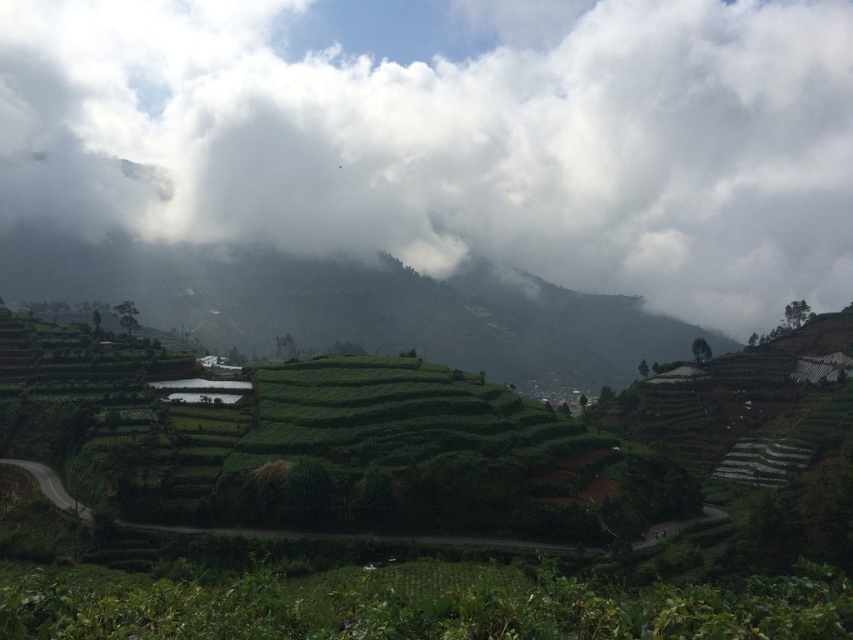
Question: Among these objects, which one is nearest to the camera?

Choices:
 (A) white fluffy cloud at upper center
 (B) green grassy hillside at center

Answer: (B)

Question: Which point appears closest to the camera in this image?

Choices:
 (A) (85, 19)
 (B) (329, 326)

Answer: (B)

Question: Can you confirm if white fluffy cloud at upper center is positioned below green grassy hillside at center?

Choices:
 (A) yes
 (B) no

Answer: (B)

Question: Does white fluffy cloud at upper center have a larger size compared to green grassy hillside at center?

Choices:
 (A) yes
 (B) no

Answer: (A)

Question: Can you confirm if white fluffy cloud at upper center is positioned below green grassy hillside at center?

Choices:
 (A) no
 (B) yes

Answer: (A)